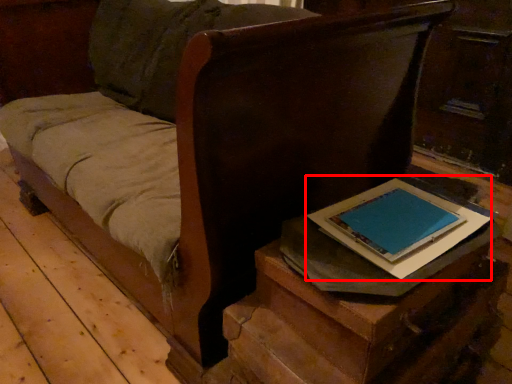
Question: From the image's perspective, considering the relative positions of paperback book (annotated by the red box) and table in the image provided, where is paperback book (annotated by the red box) located with respect to the staircase?

Choices:
 (A) below
 (B) above

Answer: (B)